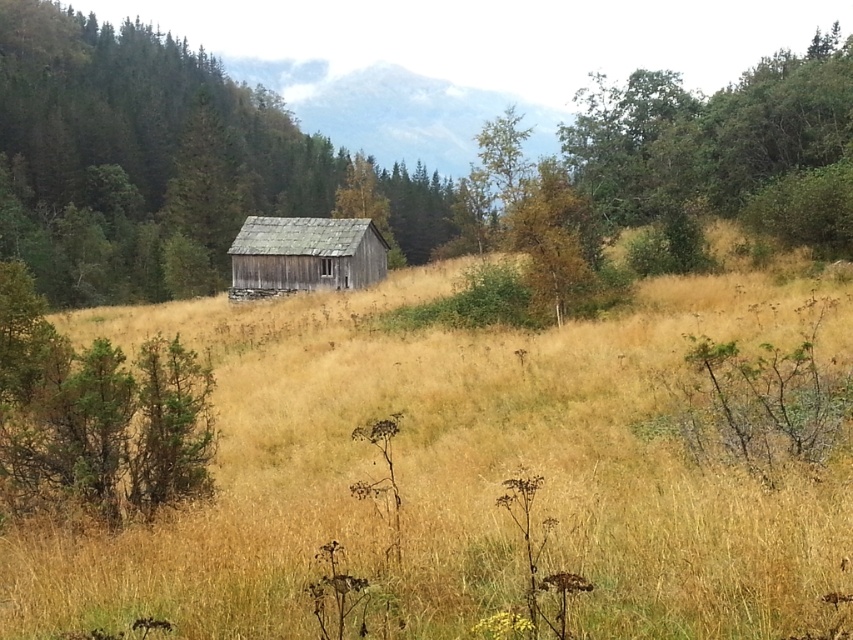
Describe the element at coordinates (161, 161) in the screenshot. I see `green textured tree at center` at that location.

Is green textured tree at center below weathered wood hut at center?

No, green textured tree at center is not below weathered wood hut at center.

Does point (410, 198) come farther from viewer compared to point (280, 259)?

Yes, it is behind point (280, 259).

This screenshot has height=640, width=853. What are the coordinates of `green textured tree at center` in the screenshot? It's located at (161, 161).